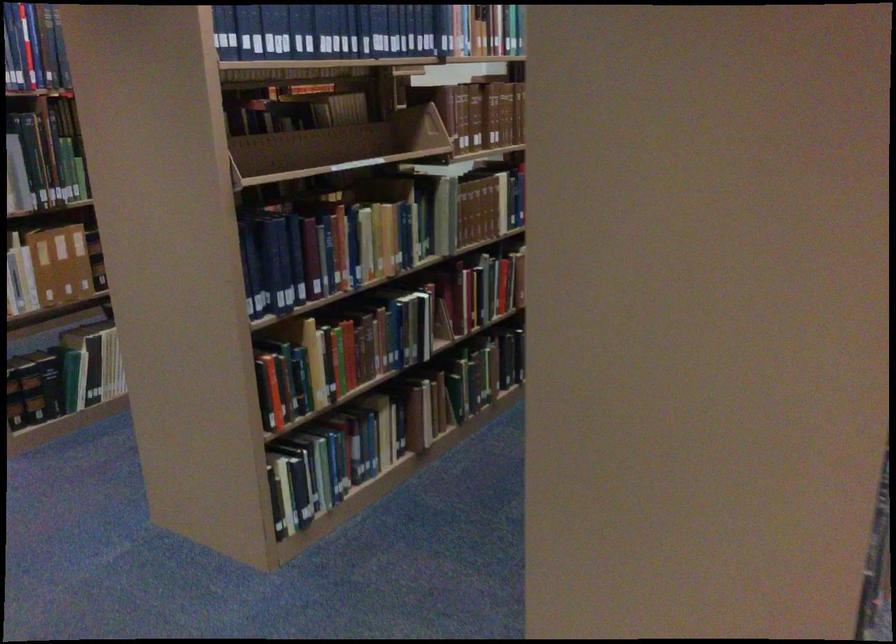
This screenshot has width=896, height=644. Identify the location of red book. (504, 285).